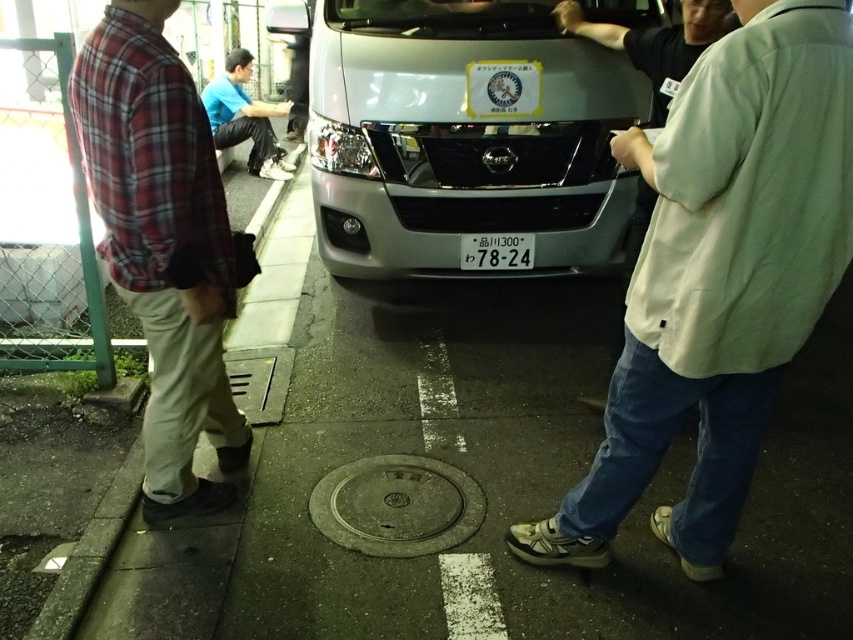
Question: From the image, what is the correct spatial relationship of satin silver van at center in relation to gray concrete curb at left?

Choices:
 (A) below
 (B) above

Answer: (B)

Question: Which object appears farthest from the camera in this image?

Choices:
 (A) plaid fabric shirt at left
 (B) white plastic license plate at center
 (C) gray metallic manhole cover at center
 (D) gray concrete curb at left

Answer: (D)

Question: Among these points, which one is nearest to the camera?

Choices:
 (A) pyautogui.click(x=65, y=580)
 (B) pyautogui.click(x=474, y=234)

Answer: (A)

Question: Is the position of gray metallic manhole cover at center less distant than that of white plastic license plate at center?

Choices:
 (A) no
 (B) yes

Answer: (B)

Question: Observing the image, what is the correct spatial positioning of light beige shirt at center in reference to satin silver van at center?

Choices:
 (A) left
 (B) right

Answer: (B)

Question: Which object is the farthest from the satin silver van at center?

Choices:
 (A) gray concrete curb at left
 (B) gray metallic manhole cover at center
 (C) blue cotton shirt at lower left
 (D) white plastic license plate at center

Answer: (C)